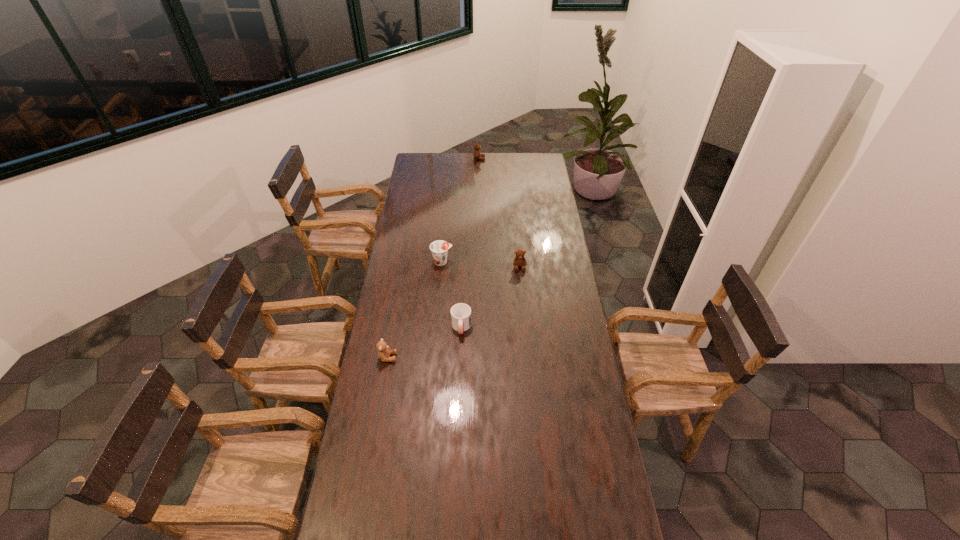
Where is `free spot between the second teddy bear from left to right and the mug`? Image resolution: width=960 pixels, height=540 pixels. free spot between the second teddy bear from left to right and the mug is located at coordinates (470, 243).

Locate an element on the screen. The image size is (960, 540). free area in between the fourth object from right to left and the farthest object is located at coordinates (461, 210).

Locate an element on the screen. This screenshot has height=540, width=960. empty location between the rightmost teddy bear and the fourth farthest object is located at coordinates (491, 297).

I want to click on vacant area that lies between the second nearest teddy bear and the fourth object from right to left, so click(x=481, y=265).

In order to click on free space between the second farthest teddy bear and the mug in this screenshot , I will do `click(491, 297)`.

Locate an element on the screen. This screenshot has width=960, height=540. the fourth closest object to the second nearest teddy bear is located at coordinates (477, 155).

Identify the location of object that is the fourth closest one to the yogurt. The image size is (960, 540). (477, 155).

Select which teddy bear is the closest to the farthest object. Please provide its 2D coordinates. Your answer should be formatted as a tuple, i.e. [(x, y)], where the tuple contains the x and y coordinates of a point satisfying the conditions above.

[(519, 261)]

Identify which teddy bear is the closest to the mug. Please provide its 2D coordinates. Your answer should be formatted as a tuple, i.e. [(x, y)], where the tuple contains the x and y coordinates of a point satisfying the conditions above.

[(384, 352)]

This screenshot has height=540, width=960. Identify the location of free point that satisfies the following two spatial constraints: 1. at the face of the farthest object; 2. on the side of the second nearest object with the handle. (479, 327).